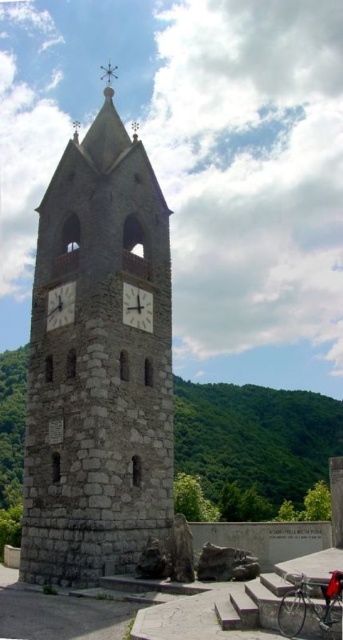
Question: Which object is farther from the camera taking this photo?

Choices:
 (A) smooth gray clock at center
 (B) stone clock tower at center
 (C) white stone clock at center

Answer: (C)

Question: Which point is closer to the camera taking this photo?

Choices:
 (A) (140, 305)
 (B) (159, 536)

Answer: (B)

Question: Can you confirm if stone clock tower at center is positioned to the left of white stone clock at center?

Choices:
 (A) no
 (B) yes

Answer: (A)

Question: Which point is closer to the camera taking this photo?

Choices:
 (A) (60, 307)
 (B) (125, 289)
 (C) (111, 380)

Answer: (C)

Question: Is stone clock tower at center bigger than smooth gray clock at center?

Choices:
 (A) yes
 (B) no

Answer: (A)

Question: Is stone clock tower at center below smooth gray clock at center?

Choices:
 (A) no
 (B) yes

Answer: (A)